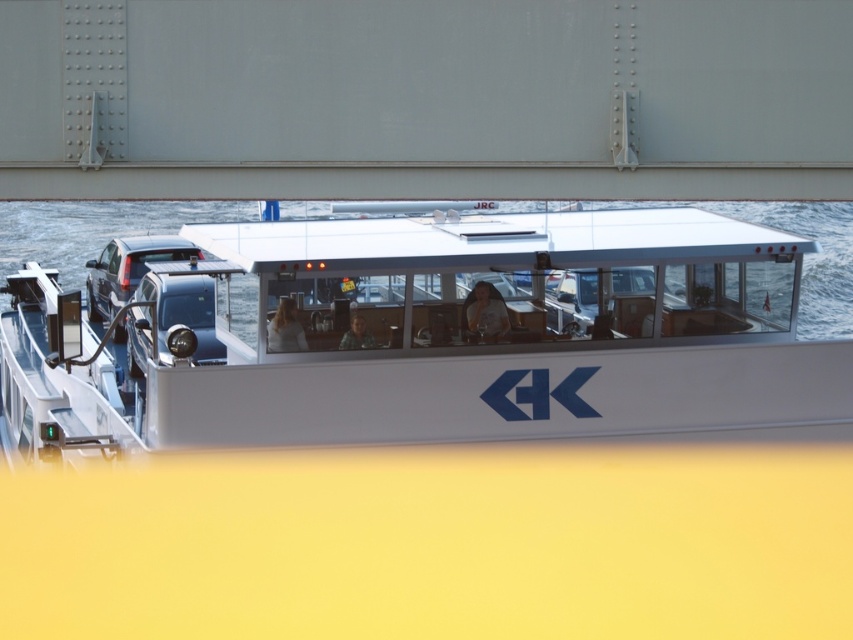
You are a photographer taking a picture of two people with smooth brown hair at center and light brown hair at center. Which person is positioned to the right of the other?

The smooth brown hair at center is positioned to the right of the light brown hair at center.